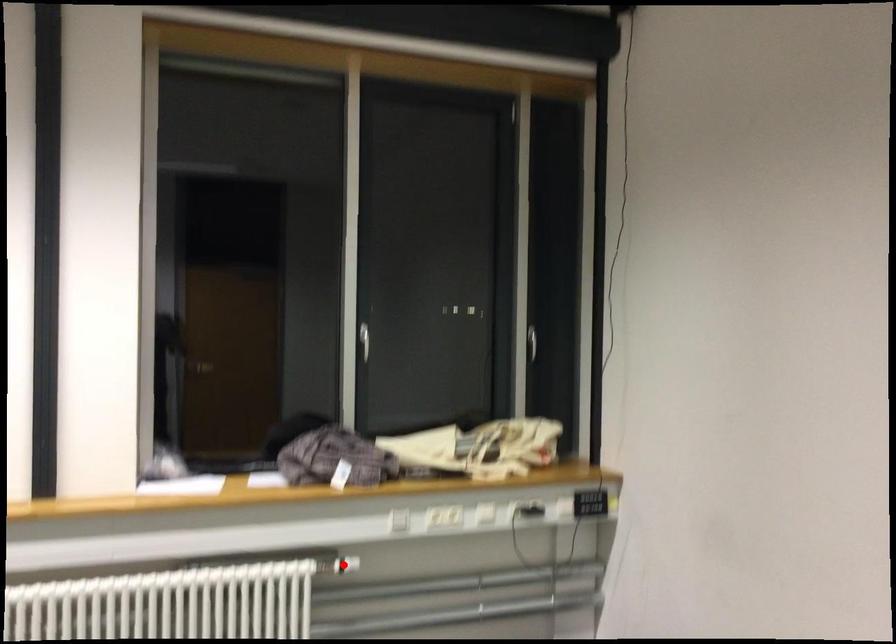
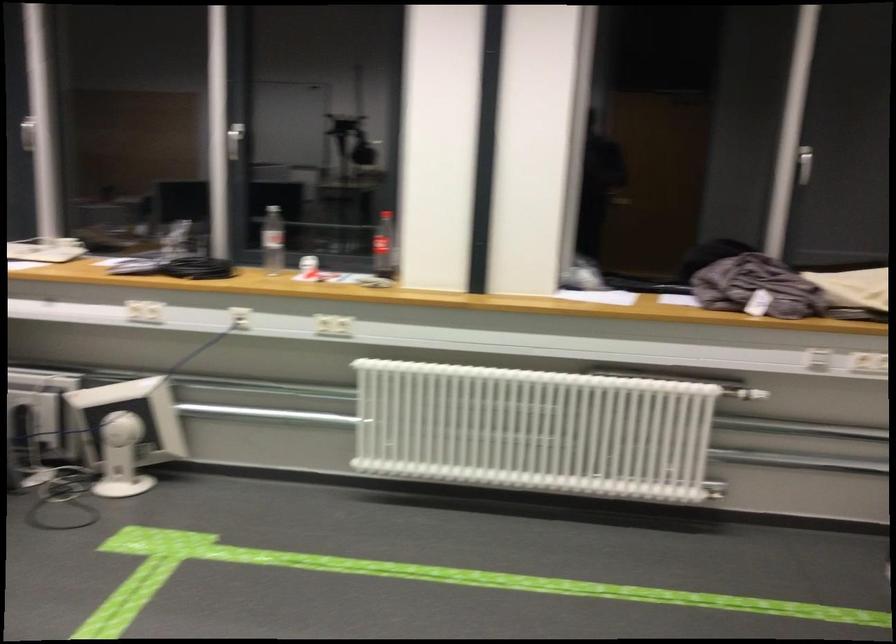
Where in the second image is the point corresponding to the highlighted location from the first image?

(751, 395)